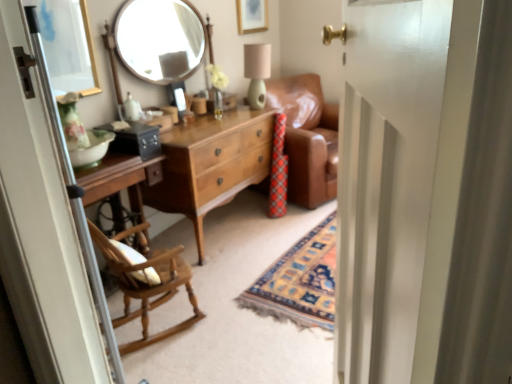
Question: Is point (69, 23) closer or farther from the camera than point (262, 57)?

Choices:
 (A) closer
 (B) farther

Answer: (A)

Question: Considering the positions of gold-framed mirror at upper left, the 1th picture frame positioned from the bottom, and matte green lampshade at upper center in the image, is gold-framed mirror at upper left, the 1th picture frame positioned from the bottom, wider or thinner than matte green lampshade at upper center?

Choices:
 (A) wide
 (B) thin

Answer: (B)

Question: Estimate the real-world distances between objects in this image. Which object is farther from the matte green lampshade at upper center?

Choices:
 (A) gold-framed picture at upper center, the first picture frame positioned from the top
 (B) white glossy door at center, which appears as the first screen door when viewed from the right
 (C) wooden screen door at left, the 2th screen door from the right
 (D) matte brown coffee cup at center
 (E) light brown wood dresser at center

Answer: (C)

Question: Estimate the real-world distances between objects in this image. Which object is farther from the wooden rocking chair at left?

Choices:
 (A) wooden screen door at left, the 2th screen door from the right
 (B) matte brown coffee cup at center
 (C) gold-framed mirror at upper left, arranged as the 2th picture frame when viewed from the right
 (D) light brown wood dresser at center
 (E) matte white vase at center

Answer: (B)